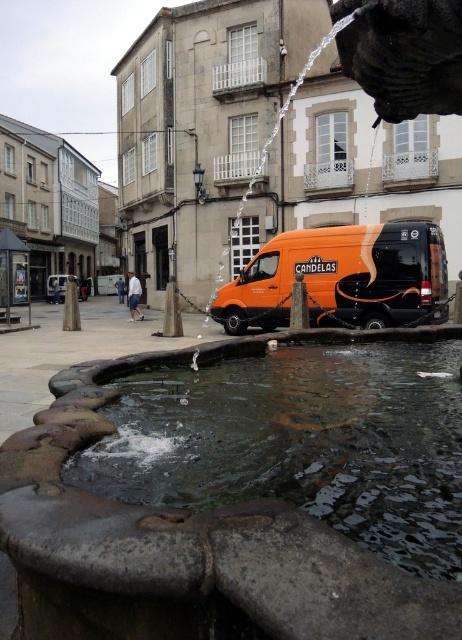
Question: Which point appears farthest from the camera in this image?

Choices:
 (A) (292, 232)
 (B) (359, 486)

Answer: (A)

Question: Which object appears closest to the camera in this image?

Choices:
 (A) dark gray stone water at center
 (B) orange matte van at center

Answer: (A)

Question: Is dark gray stone water at center below orange matte van at center?

Choices:
 (A) no
 (B) yes

Answer: (B)

Question: Is dark gray stone water at center smaller than orange matte van at center?

Choices:
 (A) no
 (B) yes

Answer: (A)

Question: Does dark gray stone water at center appear over orange matte van at center?

Choices:
 (A) no
 (B) yes

Answer: (A)